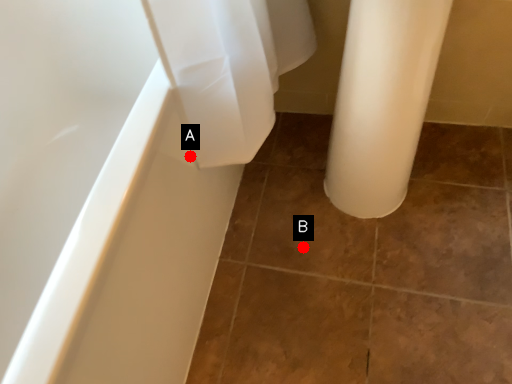
Question: Two points are circled on the image, labeled by A and B beside each circle. Which of the following is the closest to the observer?

Choices:
 (A) A is closer
 (B) B is closer

Answer: (A)